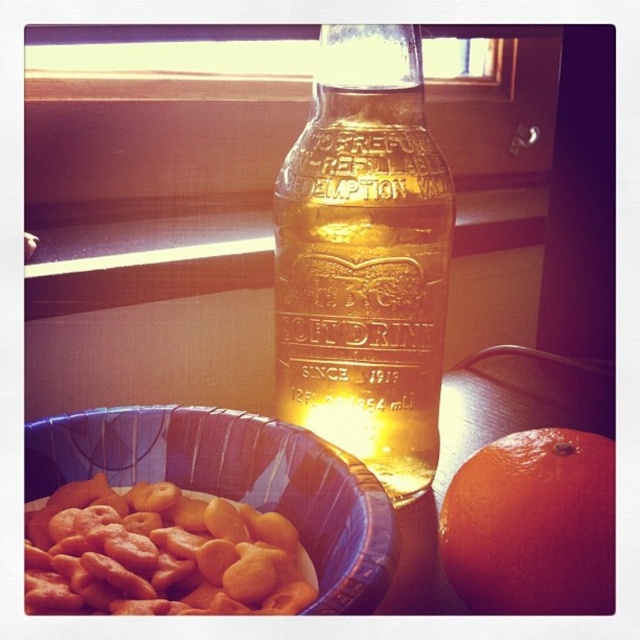
Does translucent glass bottle at center have a lesser height compared to golden crispy cereal at lower left?

No.

Who is more distant from viewer, (445, 173) or (179, 493)?

Point (445, 173)

The width and height of the screenshot is (640, 640). Identify the location of translucent glass bottle at center. (364, 259).

Looking at this image, can you confirm if golden crispy cereal at lower left is bigger than orange matte at right?

Correct, golden crispy cereal at lower left is larger in size than orange matte at right.

Between golden crispy cereal at lower left and orange matte at right, which one appears on the right side from the viewer's perspective?

From the viewer's perspective, orange matte at right appears more on the right side.

Which is in front, point (240, 534) or point (451, 499)?

Point (240, 534)

This screenshot has width=640, height=640. What are the coordinates of `golden crispy cereal at lower left` in the screenshot? It's located at (160, 554).

Between translucent glass bottle at center and orange matte at right, which one is positioned higher?

translucent glass bottle at center is above.

Does translucent glass bottle at center have a lesser height compared to orange matte at right?

No.

Where is `translucent glass bottle at center`? Image resolution: width=640 pixels, height=640 pixels. translucent glass bottle at center is located at coordinates (364, 259).